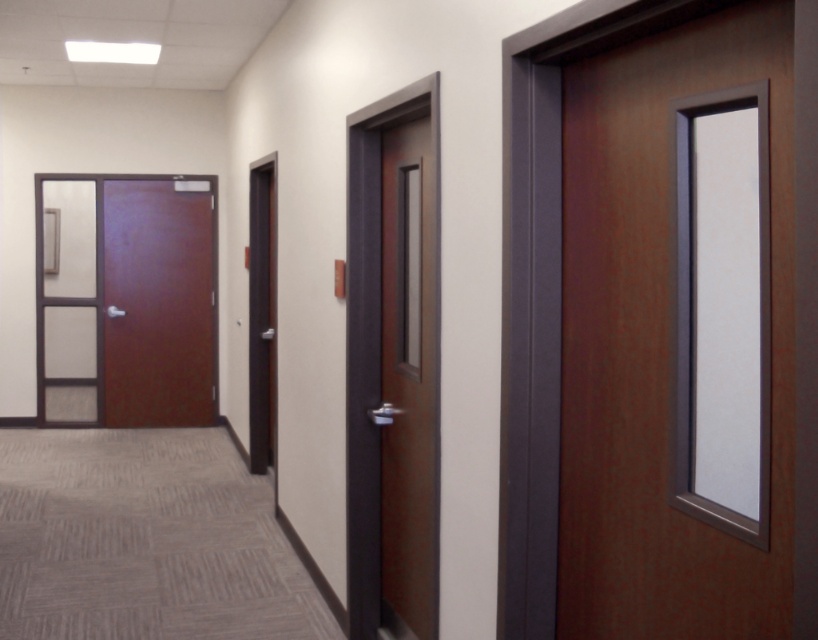
Question: Which point is farther to the camera?

Choices:
 (A) brown wood door at left
 (B) brown wood door at center

Answer: (A)

Question: Is brown wood door at left smaller than brown wood door at center?

Choices:
 (A) yes
 (B) no

Answer: (B)

Question: Observing the image, what is the correct spatial positioning of brown wood door at left in reference to brown wood door at center?

Choices:
 (A) right
 (B) left

Answer: (B)

Question: Considering the relative positions of brown wood door at left and brown wood door at center in the image provided, where is brown wood door at left located with respect to brown wood door at center?

Choices:
 (A) left
 (B) right

Answer: (A)